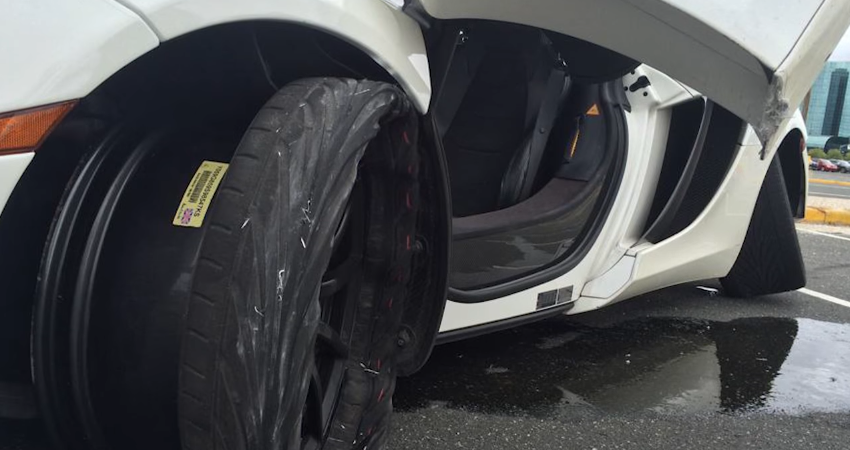
Where is `hood`? The width and height of the screenshot is (850, 450). hood is located at coordinates (49, 72).